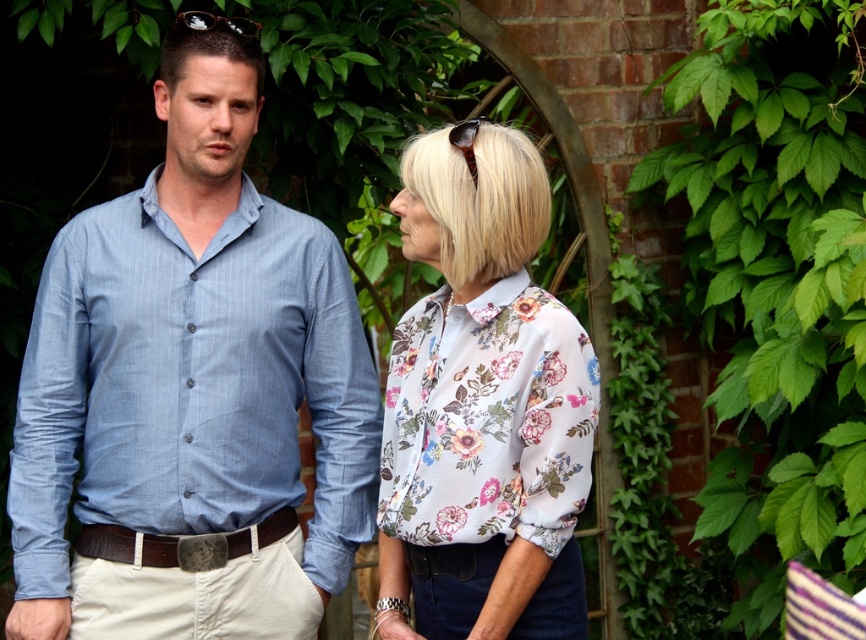
Question: Among these objects, which one is farthest from the camera?

Choices:
 (A) floral print blouse at center
 (B) light blue cotton shirt at left

Answer: (B)

Question: Which of these objects is positioned farthest from the floral print blouse at center?

Choices:
 (A) light blue cotton shirt at left
 (B) brown leather belt at center

Answer: (B)

Question: Based on their relative distances, which object is nearer to the light blue cotton shirt at left?

Choices:
 (A) brown leather belt at center
 (B) floral print blouse at center

Answer: (A)

Question: Can you confirm if light blue cotton shirt at left is positioned above brown leather belt at center?

Choices:
 (A) no
 (B) yes

Answer: (B)

Question: Considering the relative positions of light blue cotton shirt at left and floral print blouse at center in the image provided, where is light blue cotton shirt at left located with respect to floral print blouse at center?

Choices:
 (A) above
 (B) below

Answer: (A)

Question: Does light blue cotton shirt at left have a larger size compared to brown leather belt at center?

Choices:
 (A) no
 (B) yes

Answer: (B)